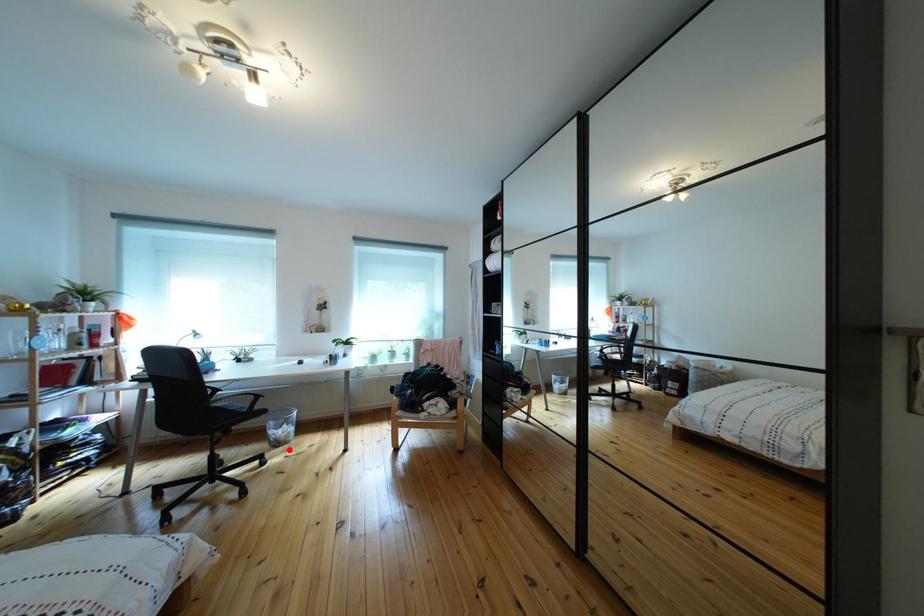
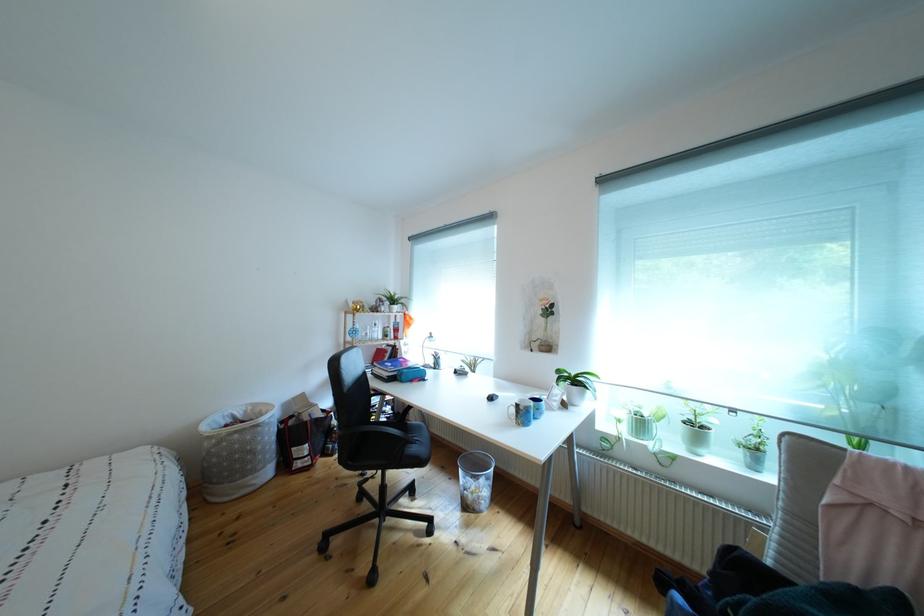
Question: I am providing you with two images of the same scene from different viewpoints. A red point is shown in image1. For the corresponding object point in image2, is it positioned nearer or farther from the camera?

Choices:
 (A) Nearer
 (B) Farther

Answer: (B)